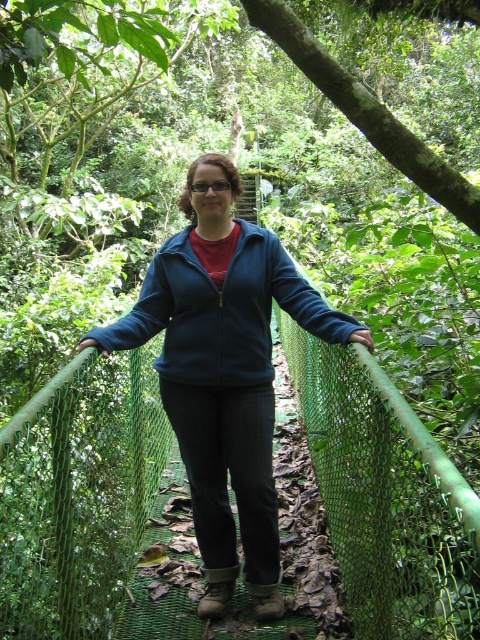
Question: Which of the following is the farthest from the observer?

Choices:
 (A) blue fleece jacket at center
 (B) blue fleece sweatshirt at center

Answer: (B)

Question: Does blue fleece jacket at center appear on the left side of blue fleece sweatshirt at center?

Choices:
 (A) no
 (B) yes

Answer: (B)

Question: Among these points, which one is nearest to the camera?

Choices:
 (A) (252, 476)
 (B) (227, 381)

Answer: (A)

Question: Is blue fleece jacket at center bigger than blue fleece sweatshirt at center?

Choices:
 (A) yes
 (B) no

Answer: (A)

Question: Is blue fleece jacket at center wider than blue fleece sweatshirt at center?

Choices:
 (A) yes
 (B) no

Answer: (A)

Question: Among these objects, which one is nearest to the camera?

Choices:
 (A) blue fleece sweatshirt at center
 (B) blue fleece jacket at center

Answer: (B)